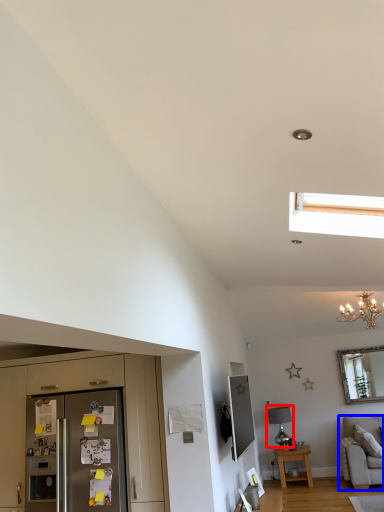
Question: Which of the following is the closest to the observer, lamp (highlighted by a red box) or studio couch (highlighted by a blue box)?

Choices:
 (A) lamp
 (B) studio couch

Answer: (B)